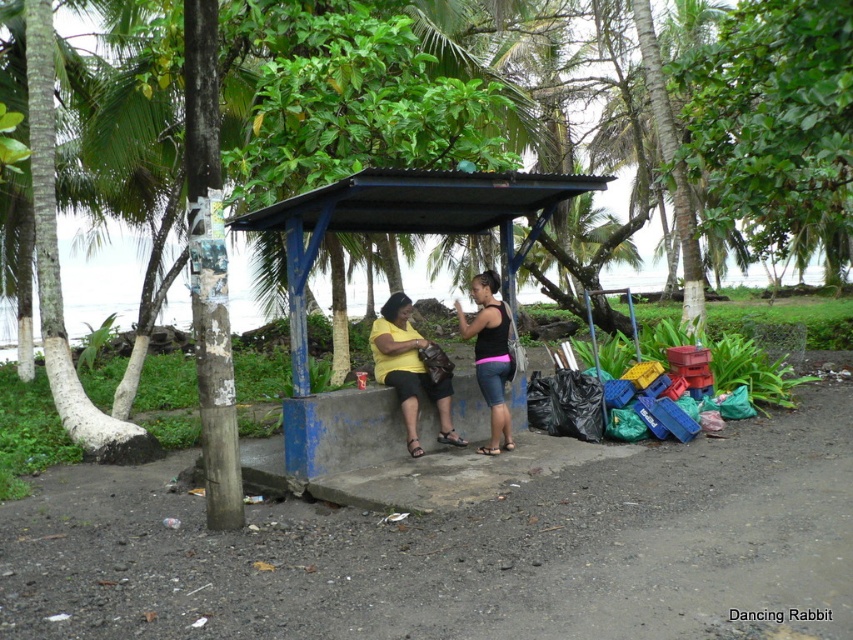
What are the coordinates of the blue painted wood bus stop at center?

The coordinates of the blue painted wood bus stop at center are at point (397, 232).

You are a photographer positioned at the end of the dirt path and want to take a photo of both the white bark tree at center and the yellow matte shirt at center. Which object will appear larger in the photo?

The white bark tree at center will appear larger in the photo because it is closer to the viewer than the yellow matte shirt at center.

You are a traveler who needs to sit down. You see a blue painted wood bus stop at center and a pink fabric shorts at center. Which object is closer to your left side if you face the bus stop?

The blue painted wood bus stop at center is positioned on the left side of pink fabric shorts at center, so if you face the bus stop, the bus stop itself is to your left relative to the pink fabric shorts. However, since you are facing the bus stop, your own left side orientation depends on your position. The question might need clarification on the observer perspective.